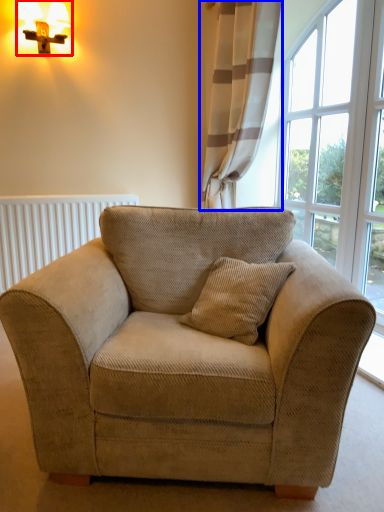
Question: Which of the following is the closest to the observer, table lamp (highlighted by a red box) or curtain (highlighted by a blue box)?

Choices:
 (A) table lamp
 (B) curtain

Answer: (B)